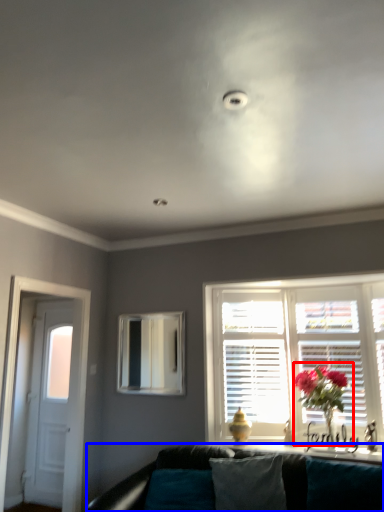
Question: Which object appears farthest to the camera in this image, floral arrangement (highlighted by a red box) or studio couch (highlighted by a blue box)?

Choices:
 (A) floral arrangement
 (B) studio couch

Answer: (A)